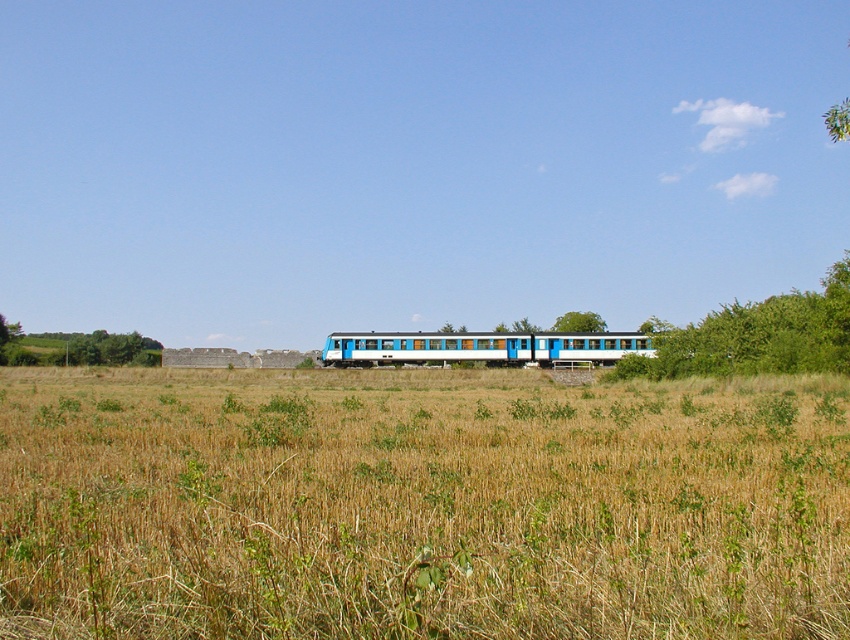
Question: Is green leafy tree at right above green leafy tree at center?

Choices:
 (A) no
 (B) yes

Answer: (B)

Question: Among these objects, which one is nearest to the camera?

Choices:
 (A) green leafy tree at center
 (B) white glossy train at center
 (C) green leafy tree at right

Answer: (C)

Question: Is green leafy tree at right wider than white glossy train at center?

Choices:
 (A) no
 (B) yes

Answer: (B)

Question: Is white glossy train at center positioned behind green leafy tree at center?

Choices:
 (A) no
 (B) yes

Answer: (A)

Question: Estimate the real-world distances between objects in this image. Which object is closer to the green leafy tree at left?

Choices:
 (A) white glossy train at center
 (B) green leafy tree at center

Answer: (A)

Question: Which point is closer to the camera taking this photo?

Choices:
 (A) (383, 346)
 (B) (578, 320)
 (C) (741, 324)

Answer: (C)